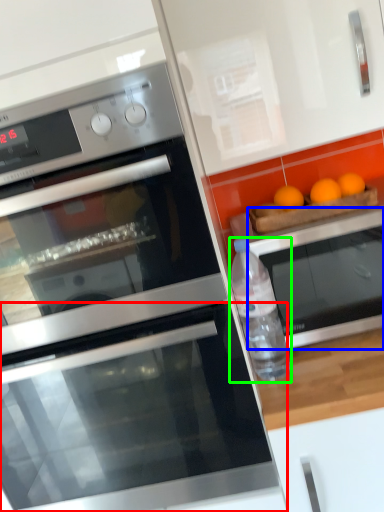
Question: Considering the real-world distances, which object is closest to oven (highlighted by a red box)? oven (highlighted by a blue box) or bottle (highlighted by a green box).

Choices:
 (A) oven
 (B) bottle

Answer: (B)